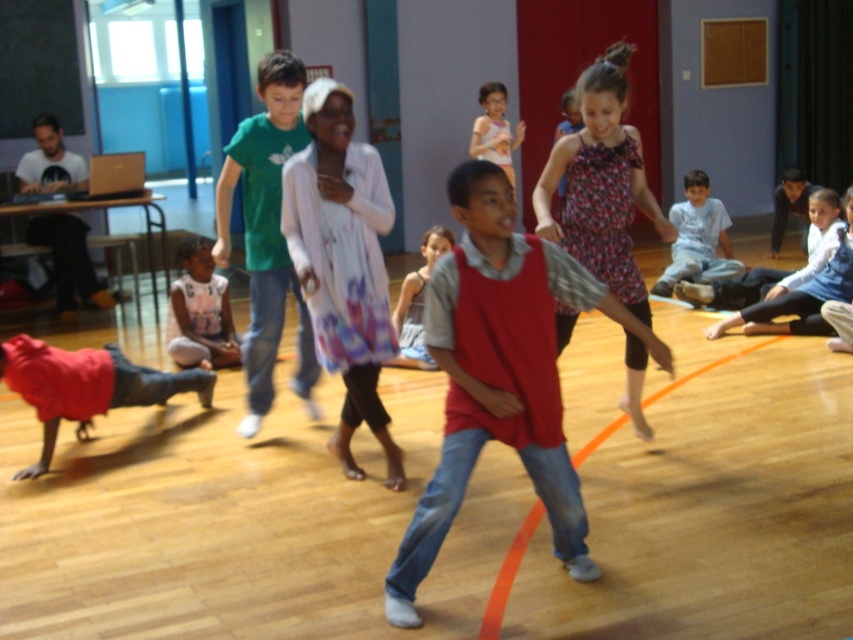
You are a photographer setting up a camera to capture the children in the dance class. You notice the light blue cotton shirt at center and the light blue denim shorts at center. Which clothing item should you focus on if you want to capture the wider object in your shot?

The light blue cotton shirt at center might be wider than light blue denim shorts at center, so focusing on the light blue cotton shirt at center would be better to capture the wider object.

You are a photographer setting up for a dance class photo shoot. You need to ensure that both the red cotton vest at center and the floral dress at center are clearly visible in the shot. Based on their positions, which clothing item is closer to the camera?

The red cotton vest at center is positioned under the floral dress at center, meaning it is closer to the camera.